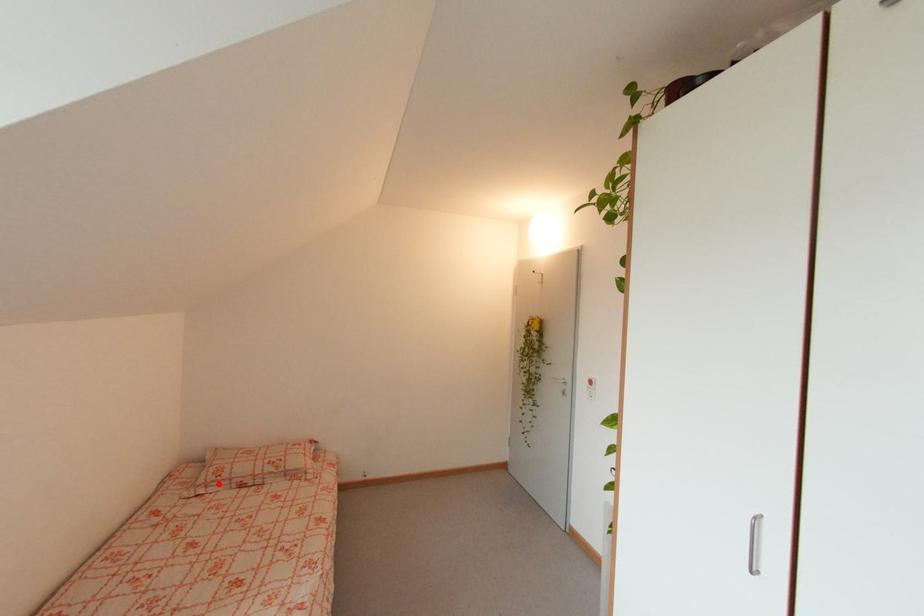
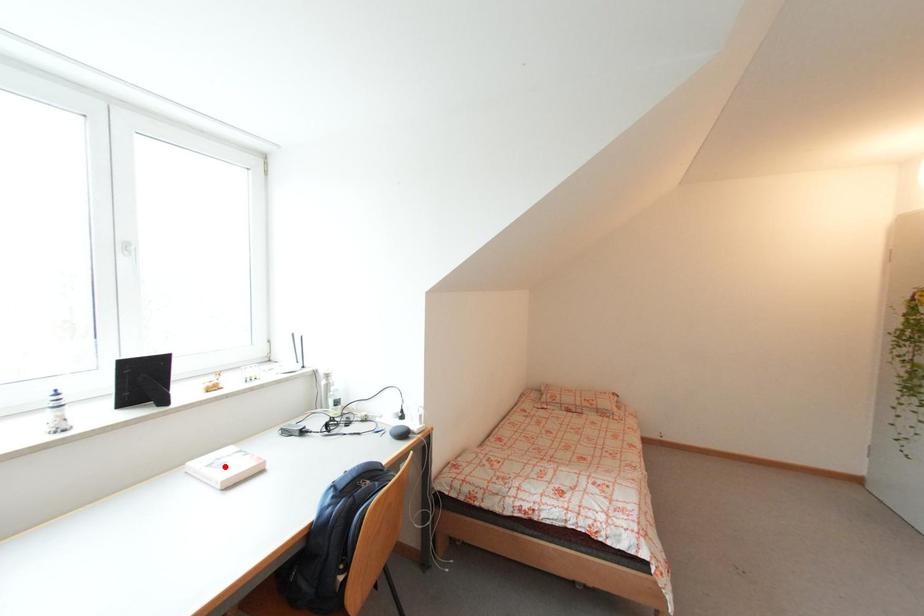
I am providing you with two images of the same scene from different viewpoints. A red point is marked on the first image and another point is marked on the second image. Does the point marked in image1 correspond to the same location as the one in image2?

No